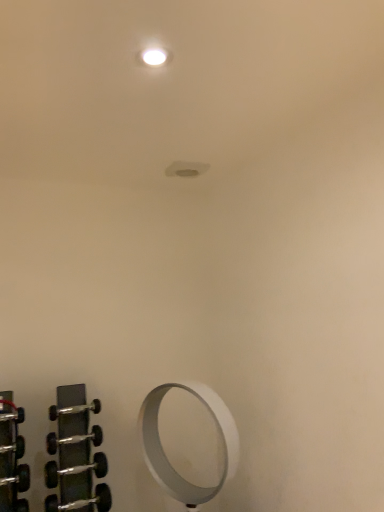
This screenshot has width=384, height=512. What do you see at coordinates (165, 453) in the screenshot? I see `white matte ring at lower center` at bounding box center [165, 453].

Identify the location of white matte ring at lower center. The height and width of the screenshot is (512, 384). (165, 453).

Where is `white matte ring at lower center`? This screenshot has height=512, width=384. white matte ring at lower center is located at coordinates (165, 453).